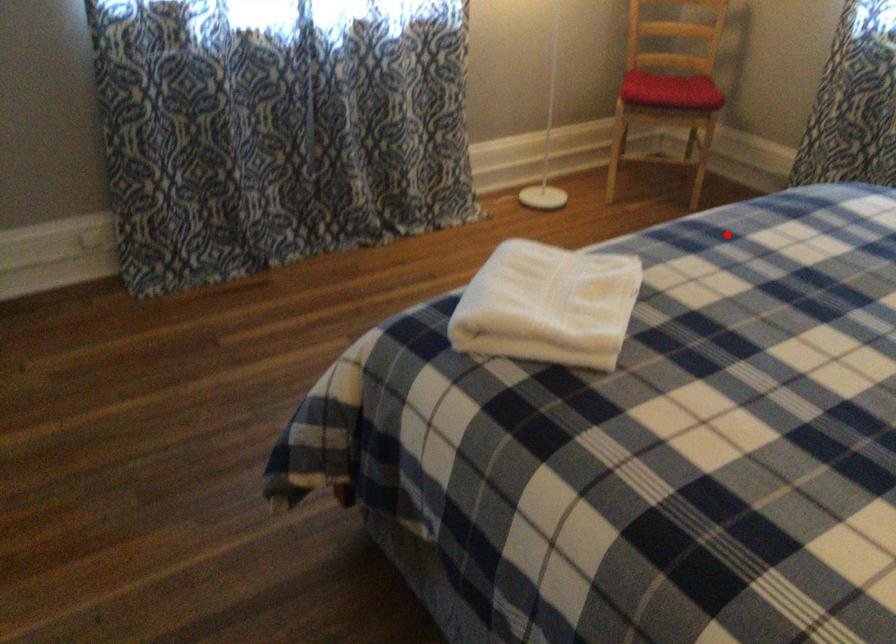
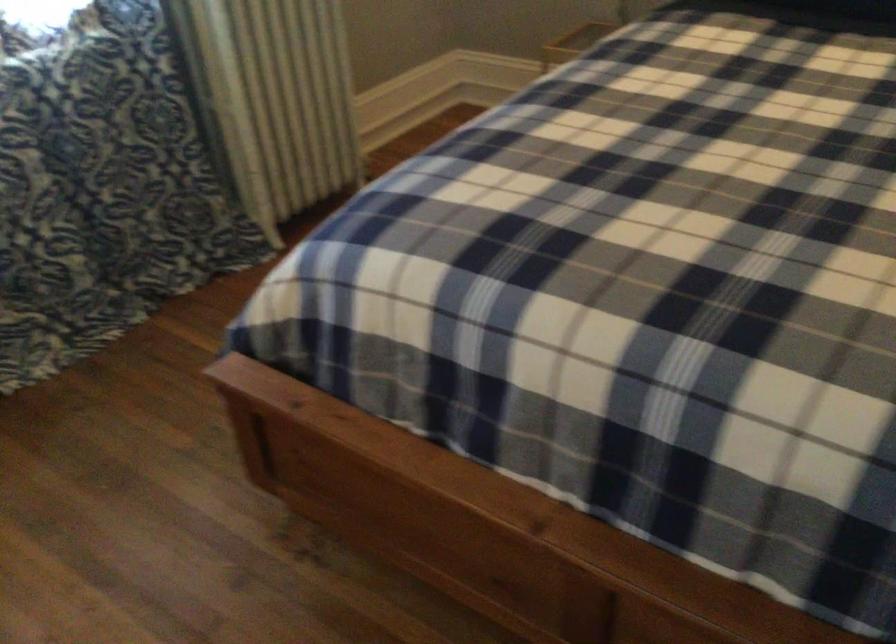
In the second image, find the point that corresponds to the highlighted location in the first image.

(633, 279)